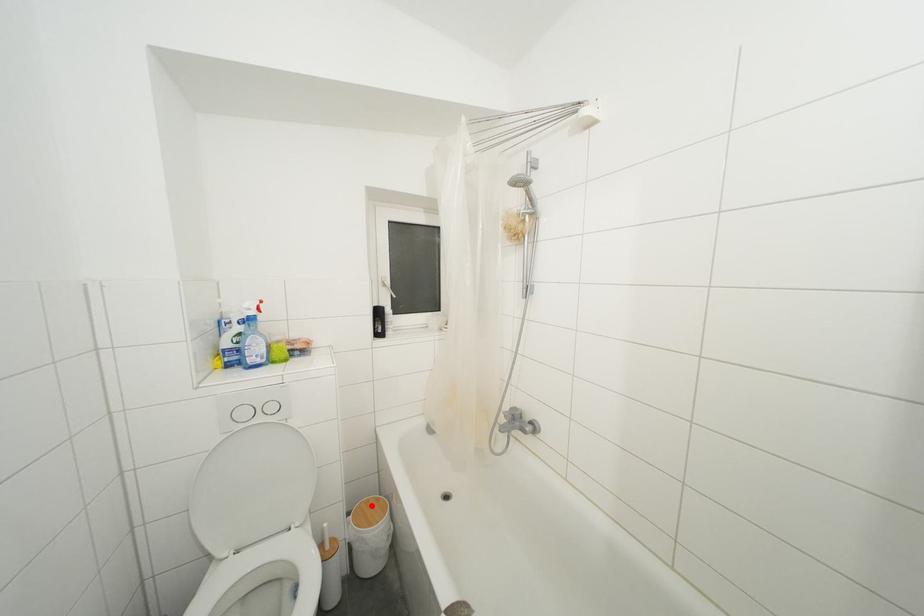
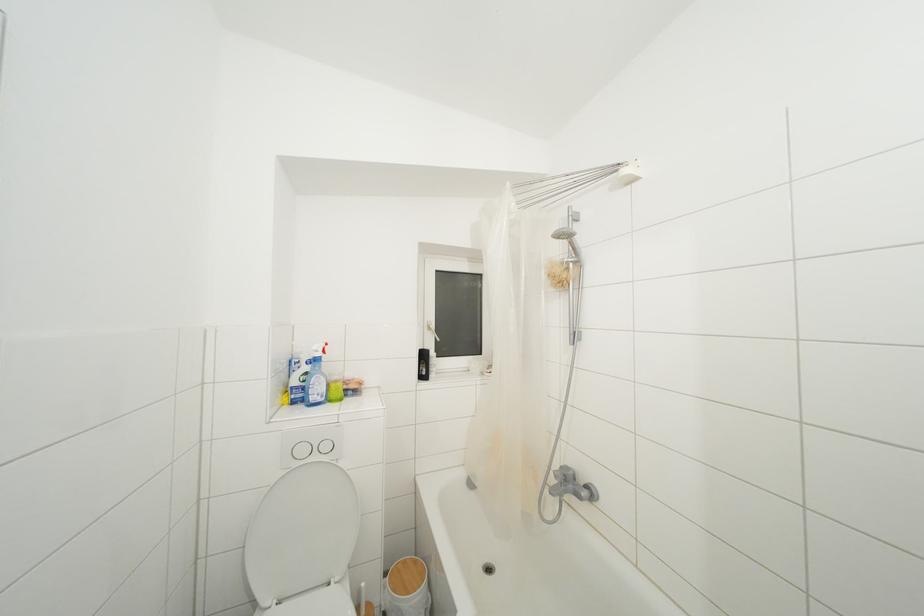
Where in the second image is the point corresponding to the highlighted location from the first image?

(408, 567)